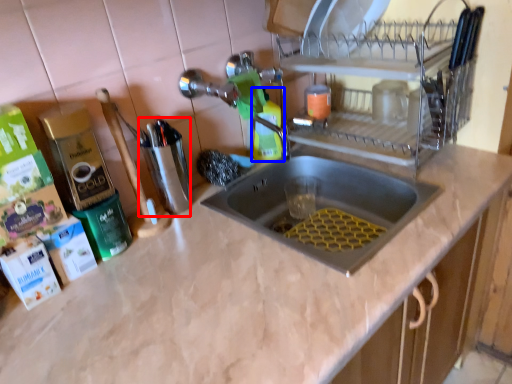
Question: Which object appears closest to the camera in this image, appliance (highlighted by a red box) or cleaning product (highlighted by a blue box)?

Choices:
 (A) appliance
 (B) cleaning product

Answer: (A)